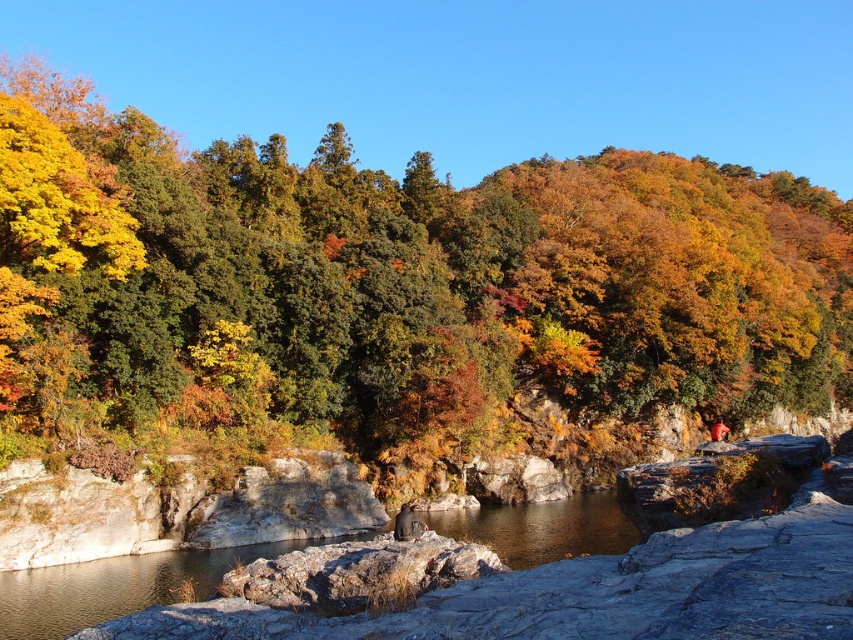
Between yellow-green leaves at center and rough gray rock at center, which one has more height?

yellow-green leaves at center is taller.

Does point (204, 266) lie behind point (354, 570)?

That is True.

What do you see at coordinates (392, 292) in the screenshot?
I see `yellow-green leaves at center` at bounding box center [392, 292].

Image resolution: width=853 pixels, height=640 pixels. Identify the location of yellow-green leaves at center. (392, 292).

Looking at this image, does brown rock at center appear on the right side of rough gray rock at center?

Correct, you'll find brown rock at center to the right of rough gray rock at center.

Is point (21, 584) positioned after point (473, 548)?

Yes, it is behind point (473, 548).

Image resolution: width=853 pixels, height=640 pixels. Identify the location of brown rock at center. (119, 586).

Does yellow-green leaves at center appear under dark gray fabric person at center?

Incorrect, yellow-green leaves at center is not positioned below dark gray fabric person at center.

This screenshot has width=853, height=640. I want to click on yellow-green leaves at center, so click(392, 292).

The width and height of the screenshot is (853, 640). I want to click on yellow-green leaves at center, so click(x=392, y=292).